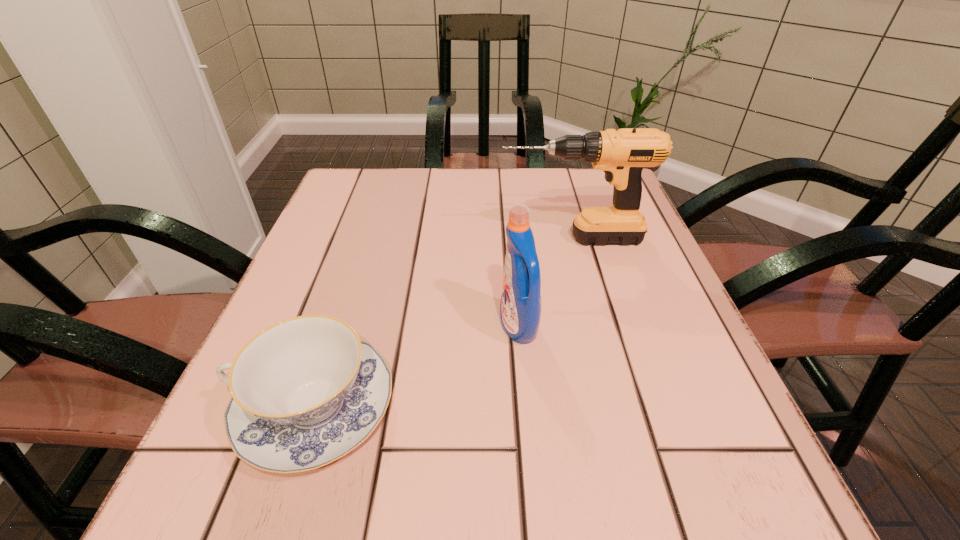
Where is `object that stands as the second closest to the detergent`? This screenshot has width=960, height=540. object that stands as the second closest to the detergent is located at coordinates (622, 155).

Select which object appears as the second closest to the drill. Please provide its 2D coordinates. Your answer should be formatted as a tuple, i.e. [(x, y)], where the tuple contains the x and y coordinates of a point satisfying the conditions above.

[(306, 391)]